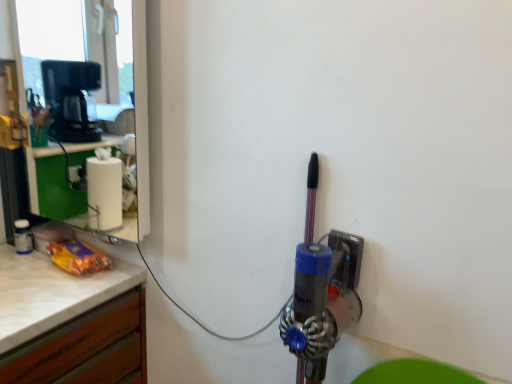
Question: Should I look upward or downward to see transparent glass door at upper left?

Choices:
 (A) up
 (B) down

Answer: (A)